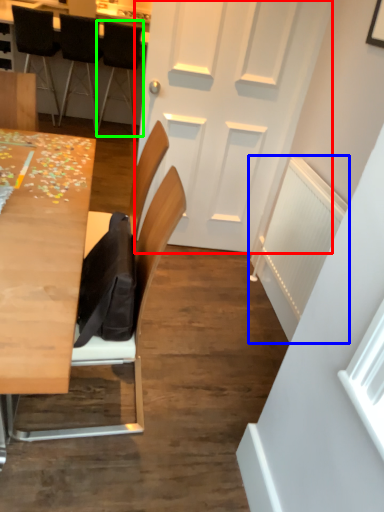
Question: Considering the real-world distances, which object is closest to door (highlighted by a red box)? radiator (highlighted by a blue box) or chair (highlighted by a green box).

Choices:
 (A) radiator
 (B) chair

Answer: (A)